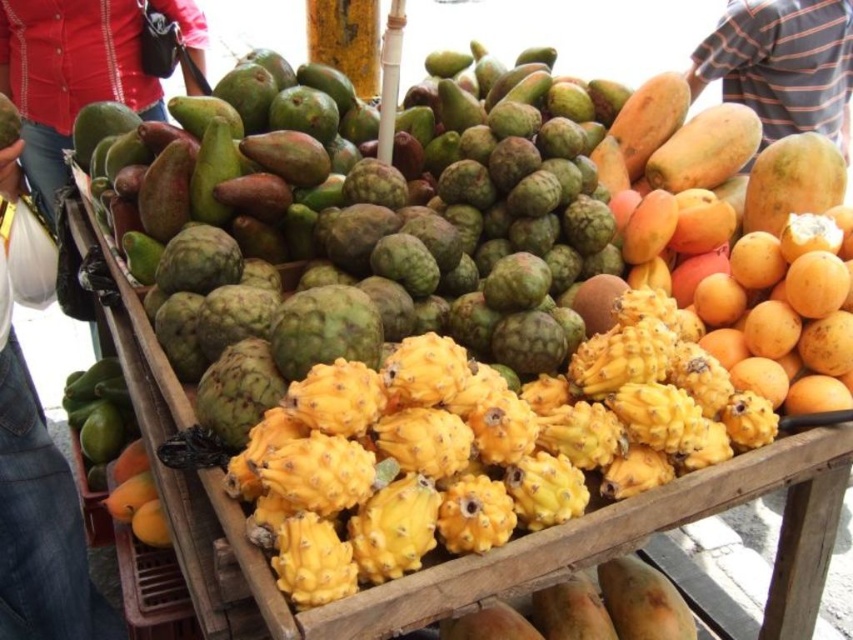
Question: Among these points, which one is nearest to the camera?

Choices:
 (A) (752, 16)
 (B) (109, 54)

Answer: (B)

Question: Is matte red shirt at upper left wider than striped cotton shirt at upper right?

Choices:
 (A) no
 (B) yes

Answer: (A)

Question: Is matte red shirt at upper left behind striped cotton shirt at upper right?

Choices:
 (A) no
 (B) yes

Answer: (A)

Question: Which point is farther to the camera?

Choices:
 (A) matte red shirt at upper left
 (B) striped cotton shirt at upper right

Answer: (B)

Question: Which point is farther to the camera?

Choices:
 (A) (751, 28)
 (B) (128, 92)

Answer: (A)

Question: Is matte red shirt at upper left further to the viewer compared to striped cotton shirt at upper right?

Choices:
 (A) no
 (B) yes

Answer: (A)